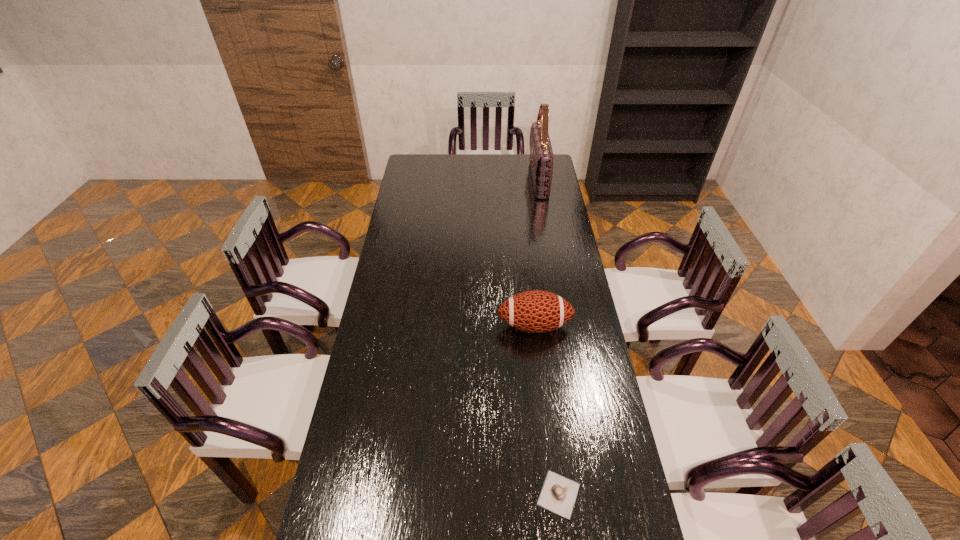
Image resolution: width=960 pixels, height=540 pixels. I want to click on empty space between the second nearest object and the tallest object, so click(x=537, y=252).

Identify the location of free space between the nearest object and the handbag. The width and height of the screenshot is (960, 540). (548, 337).

Find the location of a particular element. This screenshot has width=960, height=540. free space that is in between the farthest object and the second farthest object is located at coordinates (537, 252).

What are the coordinates of `free space between the football and the shortest object` in the screenshot? It's located at (546, 410).

This screenshot has width=960, height=540. Identify the location of empty location between the farthest object and the shortest object. coord(548,337).

Where is `unoccupied position between the shortest object and the second nearest object`? The height and width of the screenshot is (540, 960). unoccupied position between the shortest object and the second nearest object is located at coordinates (546, 410).

Find the location of a particular element. The width and height of the screenshot is (960, 540). object that is the second closest to the second farthest object is located at coordinates (541, 155).

The width and height of the screenshot is (960, 540). What are the coordinates of `object that is the closest one to the nearest object` in the screenshot? It's located at (536, 311).

Where is `free spot that satisfies the following two spatial constraints: 1. on the front of the tallest object with the clasp; 2. on the front side of the nearest object`? This screenshot has height=540, width=960. free spot that satisfies the following two spatial constraints: 1. on the front of the tallest object with the clasp; 2. on the front side of the nearest object is located at coordinates (593, 494).